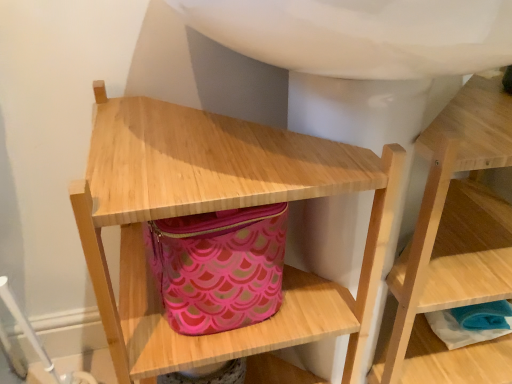
The width and height of the screenshot is (512, 384). What do you see at coordinates (218, 209) in the screenshot?
I see `natural wood shelf at center, which appears as the 2th shelf when viewed from the right` at bounding box center [218, 209].

Image resolution: width=512 pixels, height=384 pixels. I want to click on pink fabric bag at center, so click(x=219, y=267).

Based on the photo, would you say natural wood shelf at center, which ranks as the 1th shelf in left-to-right order, is part of wooden shelf at center, positioned as the second shelf in left-to-right order,'s contents?

No.

Considering the sizes of objects wooden shelf at center, which appears as the first shelf when viewed from the right, and natural wood shelf at center, which appears as the 2th shelf when viewed from the right, in the image provided, who is smaller, wooden shelf at center, which appears as the first shelf when viewed from the right, or natural wood shelf at center, which appears as the 2th shelf when viewed from the right,?

wooden shelf at center, which appears as the first shelf when viewed from the right.

Between wooden shelf at center, positioned as the second shelf in left-to-right order, and natural wood shelf at center, which ranks as the 1th shelf in left-to-right order, which one appears on the left side from the viewer's perspective?

Positioned to the left is natural wood shelf at center, which ranks as the 1th shelf in left-to-right order.

From the image's perspective, does wooden shelf at center, positioned as the second shelf in left-to-right order, appear higher than natural wood shelf at center, which appears as the 2th shelf when viewed from the right?

Yes.

Considering the positions of objects pink fabric bag at center and natural wood shelf at center, which appears as the 2th shelf when viewed from the right, in the image provided, who is behind, pink fabric bag at center or natural wood shelf at center, which appears as the 2th shelf when viewed from the right,?

pink fabric bag at center is more distant.

Is pink fabric bag at center not inside natural wood shelf at center, which appears as the 2th shelf when viewed from the right?

Actually, pink fabric bag at center is within natural wood shelf at center, which appears as the 2th shelf when viewed from the right.

How distant is pink fabric bag at center from natural wood shelf at center, which ranks as the 1th shelf in left-to-right order?

3.53 inches.

Locate an element on the screen. bag on the left of natural wood shelf at center, which ranks as the 1th shelf in left-to-right order is located at coordinates (219, 267).

Who is taller, natural wood shelf at center, which ranks as the 1th shelf in left-to-right order, or wooden shelf at center, positioned as the second shelf in left-to-right order?

natural wood shelf at center, which ranks as the 1th shelf in left-to-right order, is taller.

Is natural wood shelf at center, which ranks as the 1th shelf in left-to-right order, not within wooden shelf at center, which appears as the first shelf when viewed from the right?

Indeed, natural wood shelf at center, which ranks as the 1th shelf in left-to-right order, is completely outside wooden shelf at center, which appears as the first shelf when viewed from the right.

Could you measure the distance between natural wood shelf at center, which ranks as the 1th shelf in left-to-right order, and wooden shelf at center, positioned as the second shelf in left-to-right order?

natural wood shelf at center, which ranks as the 1th shelf in left-to-right order, is 9.48 inches from wooden shelf at center, positioned as the second shelf in left-to-right order.

From a real-world perspective, is natural wood shelf at center, which ranks as the 1th shelf in left-to-right order, physically below wooden shelf at center, positioned as the second shelf in left-to-right order?

Incorrect, from a real-world perspective, natural wood shelf at center, which ranks as the 1th shelf in left-to-right order, is higher than wooden shelf at center, positioned as the second shelf in left-to-right order.

From the image's perspective, is pink fabric bag at center positioned above or below wooden shelf at center, positioned as the second shelf in left-to-right order?

Based on their image positions, pink fabric bag at center is located above wooden shelf at center, positioned as the second shelf in left-to-right order.

Could you tell me if pink fabric bag at center is turned towards wooden shelf at center, positioned as the second shelf in left-to-right order?

No, pink fabric bag at center is not turned towards wooden shelf at center, positioned as the second shelf in left-to-right order.

Based on their positions, is pink fabric bag at center located to the left or right of wooden shelf at center, which appears as the first shelf when viewed from the right?

Based on their positions, pink fabric bag at center is located to the left of wooden shelf at center, which appears as the first shelf when viewed from the right.

Where is `the 2nd shelf located beneath the pink fabric bag at center (from a real-world perspective)`? Image resolution: width=512 pixels, height=384 pixels. the 2nd shelf located beneath the pink fabric bag at center (from a real-world perspective) is located at coordinates (454, 246).

From the pink fabric bag at center, count 1st shelf to the right and point to it. Please provide its 2D coordinates.

[(218, 209)]

Considering the points (189, 187) and (239, 211), which point is behind, point (189, 187) or point (239, 211)?

The point (239, 211) is farther from the camera.

From the image's perspective, between natural wood shelf at center, which ranks as the 1th shelf in left-to-right order, and pink fabric bag at center, which one is located above?

From the image's view, pink fabric bag at center is above.

Is natural wood shelf at center, which appears as the 2th shelf when viewed from the right, to the left or to the right of pink fabric bag at center in the image?

Clearly, natural wood shelf at center, which appears as the 2th shelf when viewed from the right, is on the right of pink fabric bag at center in the image.

Does wooden shelf at center, positioned as the second shelf in left-to-right order, have a greater height compared to pink fabric bag at center?

Indeed, wooden shelf at center, positioned as the second shelf in left-to-right order, has a greater height compared to pink fabric bag at center.

Are wooden shelf at center, which appears as the first shelf when viewed from the right, and pink fabric bag at center far apart?

They are positioned close to each other.

Is wooden shelf at center, which appears as the first shelf when viewed from the right, inside the boundaries of pink fabric bag at center, or outside?

wooden shelf at center, which appears as the first shelf when viewed from the right, is spatially situated outside pink fabric bag at center.

Where is `shelf above the wooden shelf at center, which appears as the first shelf when viewed from the right (from a real-world perspective)`? The width and height of the screenshot is (512, 384). shelf above the wooden shelf at center, which appears as the first shelf when viewed from the right (from a real-world perspective) is located at coordinates (218, 209).

The image size is (512, 384). What are the coordinates of `bag that is on the left side of natural wood shelf at center, which ranks as the 1th shelf in left-to-right order` in the screenshot? It's located at (219, 267).

Which object lies further to the anchor point pink fabric bag at center, natural wood shelf at center, which ranks as the 1th shelf in left-to-right order, or wooden shelf at center, positioned as the second shelf in left-to-right order?

Among the two, wooden shelf at center, positioned as the second shelf in left-to-right order, is located further to pink fabric bag at center.

Estimate the real-world distances between objects in this image. Which object is further from natural wood shelf at center, which appears as the 2th shelf when viewed from the right, wooden shelf at center, positioned as the second shelf in left-to-right order, or pink fabric bag at center?

wooden shelf at center, positioned as the second shelf in left-to-right order, lies further to natural wood shelf at center, which appears as the 2th shelf when viewed from the right, than the other object.

Considering their positions, is natural wood shelf at center, which ranks as the 1th shelf in left-to-right order, positioned closer to wooden shelf at center, positioned as the second shelf in left-to-right order, than pink fabric bag at center?

The object closer to wooden shelf at center, positioned as the second shelf in left-to-right order, is natural wood shelf at center, which ranks as the 1th shelf in left-to-right order.

Looking at the image, which one is located further to pink fabric bag at center, wooden shelf at center, positioned as the second shelf in left-to-right order, or natural wood shelf at center, which ranks as the 1th shelf in left-to-right order?

wooden shelf at center, positioned as the second shelf in left-to-right order, is positioned further to the anchor pink fabric bag at center.

From the image, which object appears to be farther from wooden shelf at center, positioned as the second shelf in left-to-right order, pink fabric bag at center or natural wood shelf at center, which ranks as the 1th shelf in left-to-right order?

pink fabric bag at center lies further to wooden shelf at center, positioned as the second shelf in left-to-right order, than the other object.

Estimate the real-world distances between objects in this image. Which object is further from natural wood shelf at center, which appears as the 2th shelf when viewed from the right, pink fabric bag at center or wooden shelf at center, which appears as the first shelf when viewed from the right?

Among the two, wooden shelf at center, which appears as the first shelf when viewed from the right, is located further to natural wood shelf at center, which appears as the 2th shelf when viewed from the right.

Image resolution: width=512 pixels, height=384 pixels. I want to click on shelf between pink fabric bag at center and wooden shelf at center, positioned as the second shelf in left-to-right order, so click(218, 209).